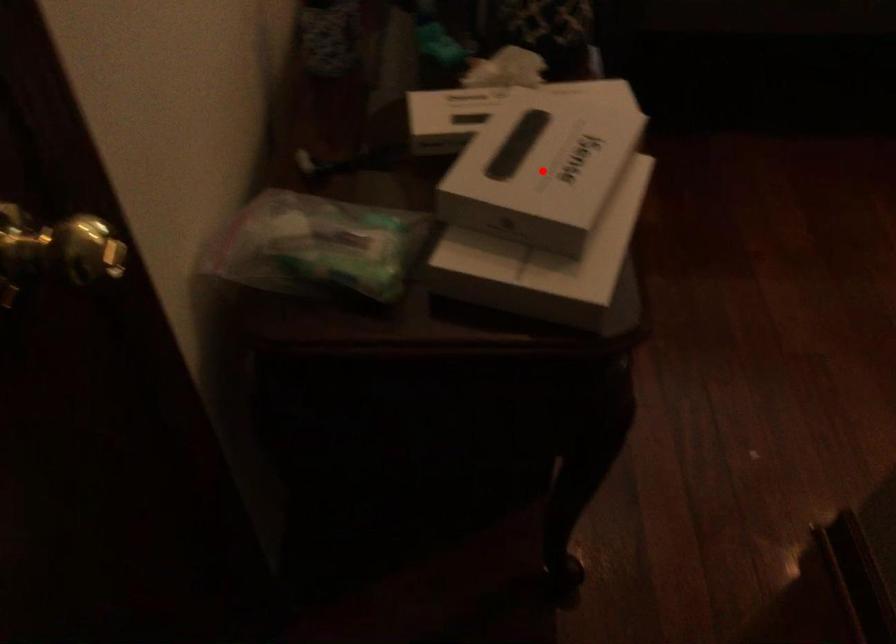
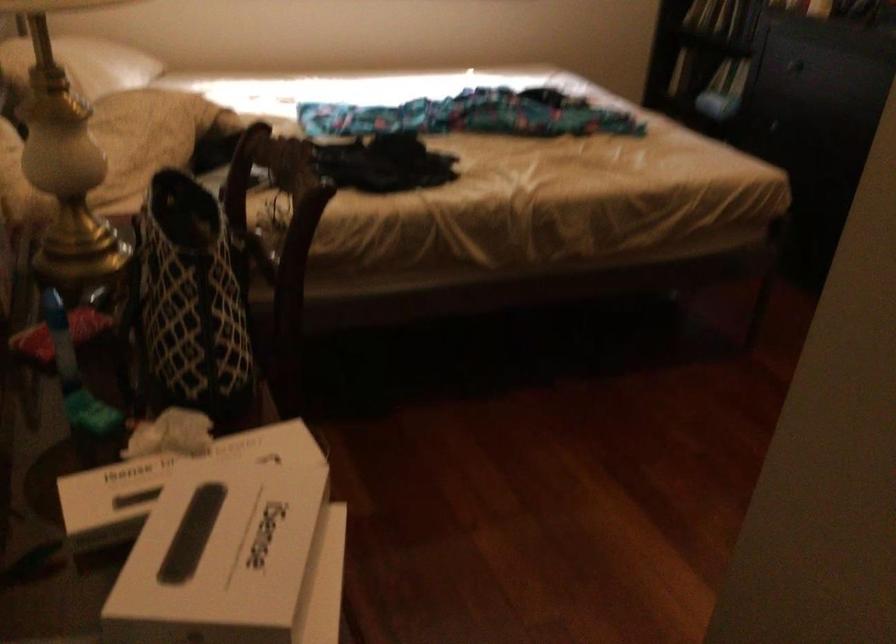
Question: I am providing you with two images of the same scene from different viewpoints. Image1 has a red point marked. In image2, the corresponding 3D location appears at what relative position? Reply with the corresponding letter.

Choices:
 (A) Closer
 (B) Farther

Answer: (A)